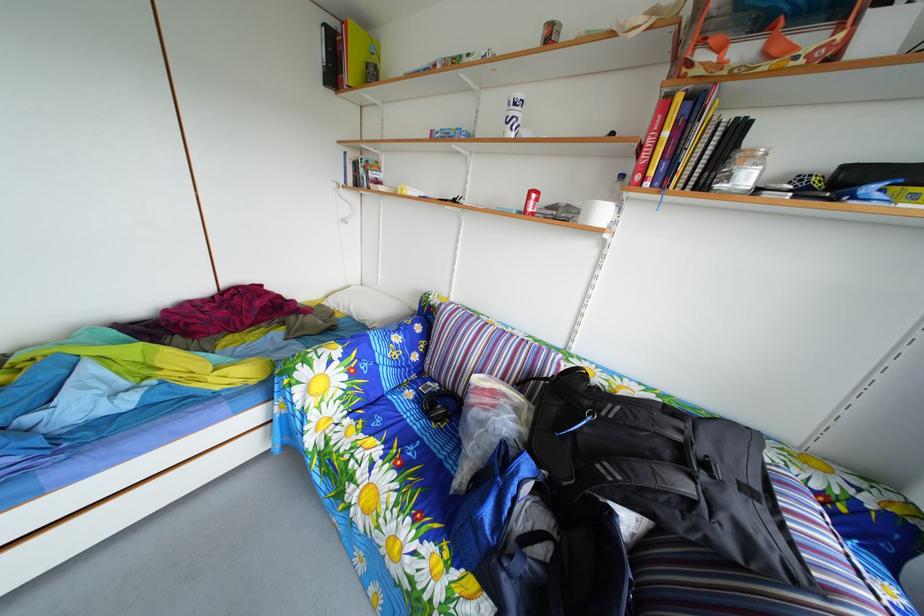
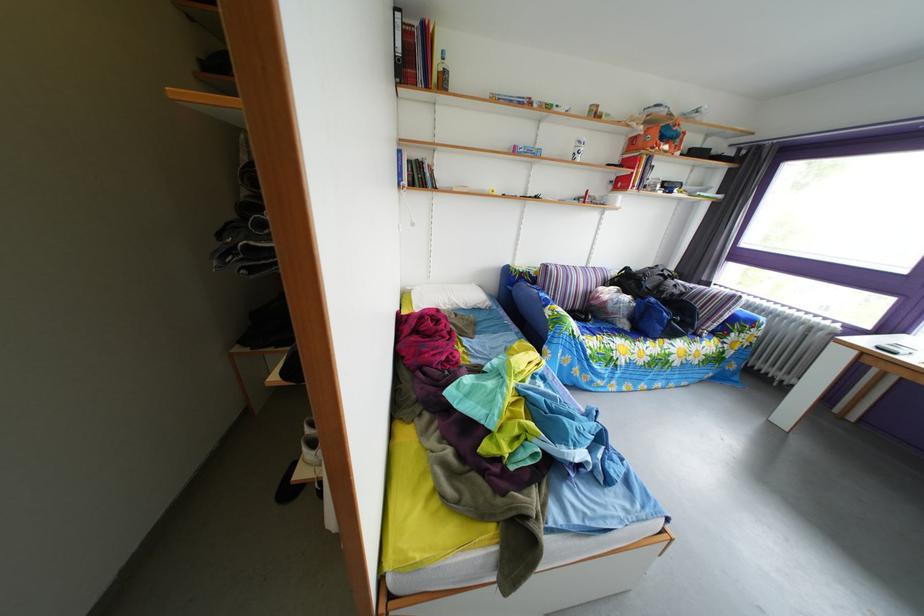
In the second image, find the point that corresponds to (772,33) in the first image.

(673, 147)